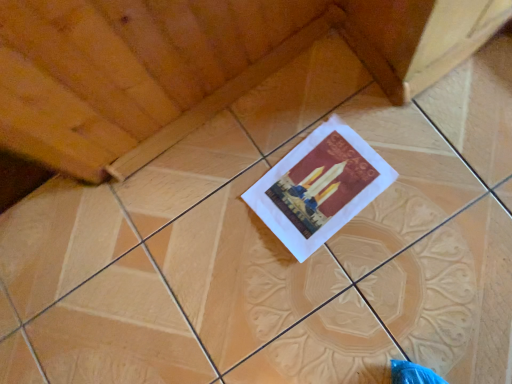
Locate an element on the screen. Image resolution: width=512 pixels, height=384 pixels. free spot above matte paper postcard at center (from a real-world perspective) is located at coordinates (318, 187).